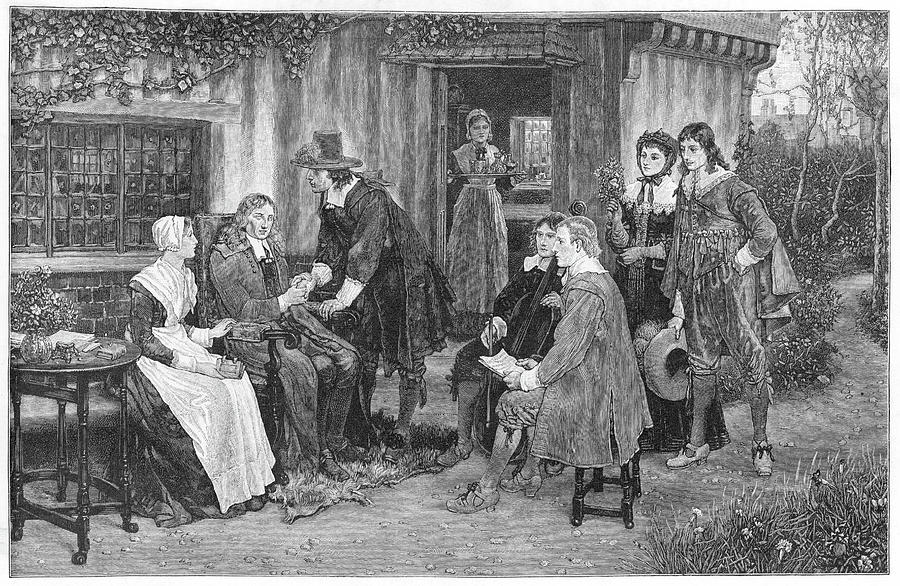
Image resolution: width=900 pixels, height=586 pixels. I want to click on round end table, so click(x=79, y=373).